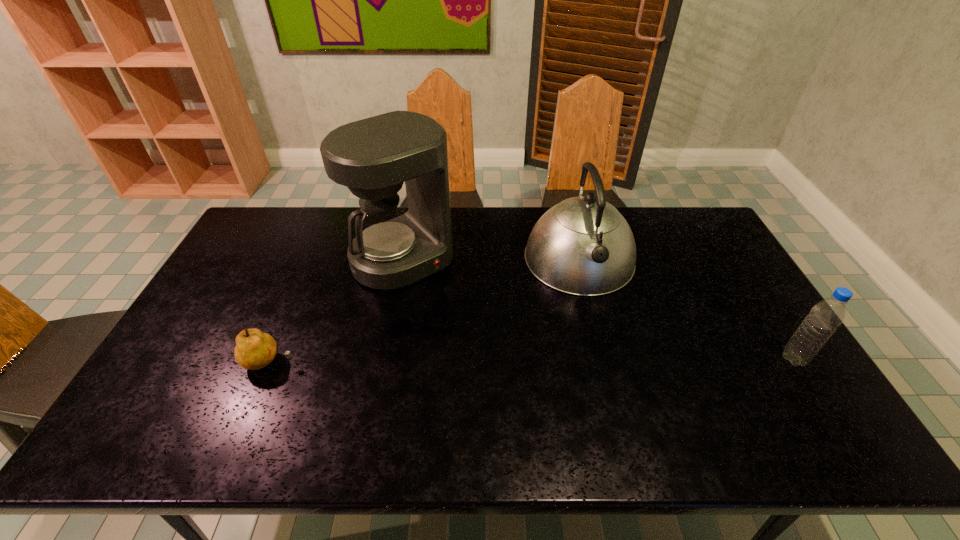
At what (x,y) coordinates should I click in order to perform the action: click on vacant space positioned 0.280m on the front-facing side of the third object from right to left. Please return your answer as a coordinate pair (x, y). Looking at the image, I should click on (482, 343).

Where is `free space located 0.370m on the front-facing side of the third object from right to left`? The image size is (960, 540). free space located 0.370m on the front-facing side of the third object from right to left is located at coordinates (502, 365).

The image size is (960, 540). Find the location of `free space located 0.180m on the front-facing side of the third object from right to left`. free space located 0.180m on the front-facing side of the third object from right to left is located at coordinates (462, 321).

Image resolution: width=960 pixels, height=540 pixels. Identify the location of vacant space located 0.090m from the spout of the kettle. (599, 323).

Find the location of a particular element. vacant region located 0.320m from the spout of the kettle is located at coordinates (620, 394).

Locate an element on the screen. Image resolution: width=960 pixels, height=540 pixels. free location located 0.310m from the spout of the kettle is located at coordinates (619, 390).

This screenshot has height=540, width=960. What are the coordinates of `coffee maker located at the far edge` in the screenshot? It's located at (394, 247).

You are a GUI agent. You are given a task and a screenshot of the screen. Output one action in this format:
    pyautogui.click(x=<x>, y=<y>)
    Task: Click on the kettle that is positioned at the far edge
    The height and width of the screenshot is (540, 960).
    Given the screenshot: What is the action you would take?
    pyautogui.click(x=583, y=246)

Locate an element on the screen. object located in the right edge section of the desktop is located at coordinates (823, 319).

The height and width of the screenshot is (540, 960). I want to click on vacant area at the far edge of the desktop, so click(x=644, y=243).